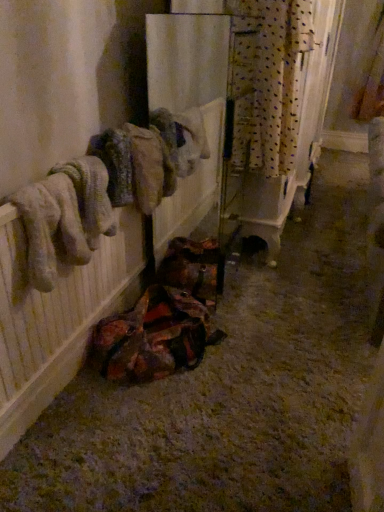
This screenshot has width=384, height=512. Find the location of `translucent polka dot curtain at upper center`. translucent polka dot curtain at upper center is located at coordinates (268, 81).

Image resolution: width=384 pixels, height=512 pixels. What do you see at coordinates (268, 81) in the screenshot? I see `translucent polka dot curtain at upper center` at bounding box center [268, 81].

What is the approximate height of translucent polka dot curtain at upper center?

73.50 centimeters.

I want to click on translucent polka dot curtain at upper center, so click(268, 81).